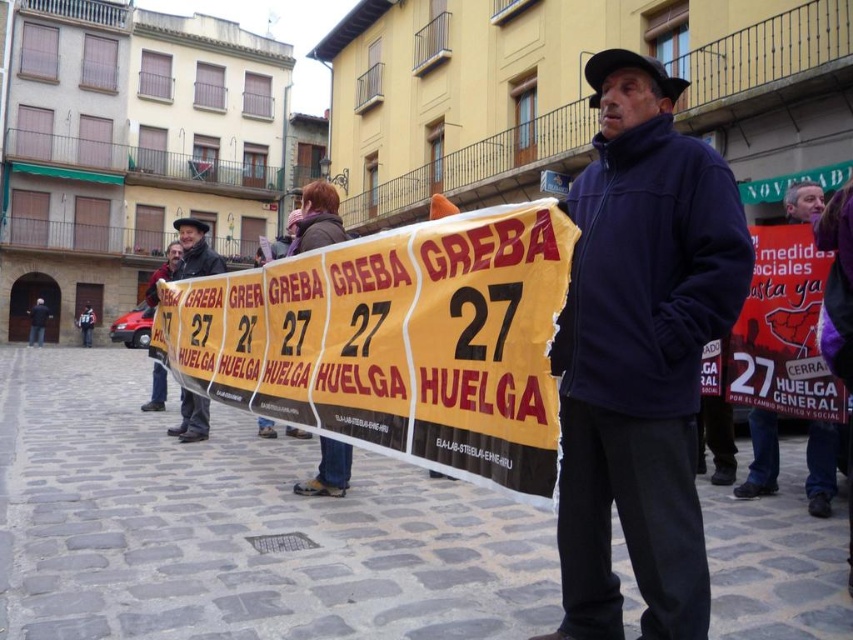
You are a photographer standing in the town square and want to capture the man in the dark blue jacket and the large yellow banner. The banner is held by people behind him. If you are standing at the point labeled as point (556, 449), which is 2.82 meters away from you, can you fit both the man and the banner in your camera frame?

The distance between you and point (556, 449) is 2.82 meters. Since the man in the dark blue jacket is positioned in front of the banner, both are within the same line of sight at that distance, so you can likely fit both in your camera frame.

You are a photographer trying to capture the entire yellow paper banner at center and the navy blue fleece jacket at center in one shot. Based on their sizes, do you think you can fit both in the frame without cropping either?

The yellow paper banner at center might be wider than navy blue fleece jacket at center, so there is a possibility that the banner could occupy more of the frame. However, since the exact dimensions aren not provided, it is uncertain if both can fit without cropping. Consider adjusting your camera angle or zoom level to accommodate both objects.